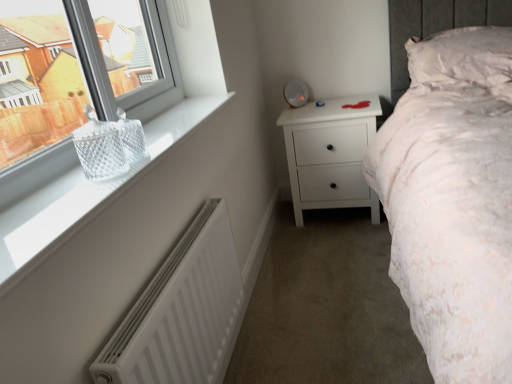
Question: Considering their positions, is clear glass basket at left, which appears as the 1th window when ordered from the bottom, located in front of or behind white matte chest of drawers at center?

Choices:
 (A) behind
 (B) front

Answer: (B)

Question: Looking at their shapes, would you say clear glass basket at left, which is the second window from top to bottom, is wider or thinner than white matte chest of drawers at center?

Choices:
 (A) thin
 (B) wide

Answer: (A)

Question: Based on their relative distances, which object is farther from the clear glass basket at upper left, which is the second window in bottom-to-top order?

Choices:
 (A) white matte radiator at lower left
 (B) white matte chest of drawers at center
 (C) white textured pillow at upper right
 (D) clear glass basket at left, which is the second window from top to bottom

Answer: (C)

Question: Considering the real-world distances, which object is closest to the white matte chest of drawers at center?

Choices:
 (A) clear glass basket at upper left, which is the second window in bottom-to-top order
 (B) white matte radiator at lower left
 (C) white textured pillow at upper right
 (D) clear glass basket at left, which is the second window from top to bottom

Answer: (C)